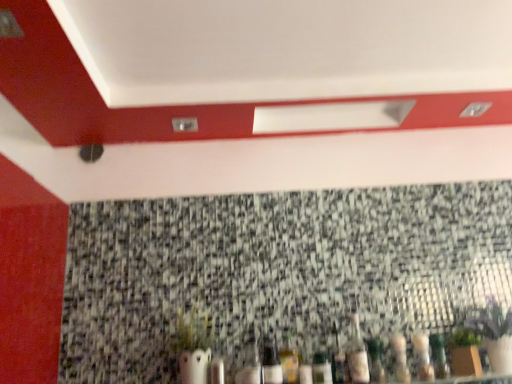
Question: Should I look upward or downward to see granite mosaic at center?

Choices:
 (A) down
 (B) up

Answer: (A)

Question: Is translucent glass bottle at lower right, marked as the first bottle in a right-to-left arrangement, at the right side of translucent glass bottle at center, which ranks as the 5th bottle in right-to-left order?

Choices:
 (A) no
 (B) yes

Answer: (B)

Question: Is translucent glass bottle at center, the 3th bottle from the left, at the back of translucent glass bottle at lower right, marked as the first bottle in a right-to-left arrangement?

Choices:
 (A) yes
 (B) no

Answer: (B)

Question: Is translucent glass bottle at lower right, marked as the first bottle in a right-to-left arrangement, far from translucent glass bottle at center, the 3th bottle from the left?

Choices:
 (A) no
 (B) yes

Answer: (A)

Question: Is translucent glass bottle at lower right, marked as the first bottle in a right-to-left arrangement, thinner than translucent glass bottle at center, which ranks as the 5th bottle in right-to-left order?

Choices:
 (A) no
 (B) yes

Answer: (A)

Question: Is translucent glass bottle at lower right, which is the 7th bottle in left-to-right order, to the left of translucent glass bottle at center, which ranks as the 5th bottle in right-to-left order, from the viewer's perspective?

Choices:
 (A) yes
 (B) no

Answer: (B)

Question: Considering the relative positions of translucent glass bottle at lower right, which is the 7th bottle in left-to-right order, and translucent glass bottle at center, which ranks as the 5th bottle in right-to-left order, in the image provided, is translucent glass bottle at lower right, which is the 7th bottle in left-to-right order, behind translucent glass bottle at center, which ranks as the 5th bottle in right-to-left order,?

Choices:
 (A) no
 (B) yes

Answer: (B)

Question: Is translucent glass bottle at lower center, arranged as the 6th bottle when viewed from the right, positioned before clear glass bottle at center, acting as the seventh bottle starting from the right?

Choices:
 (A) yes
 (B) no

Answer: (B)

Question: Is translucent glass bottle at lower center, the second bottle when ordered from left to right, aimed at clear glass bottle at center, acting as the seventh bottle starting from the right?

Choices:
 (A) yes
 (B) no

Answer: (B)

Question: Considering the relative sizes of translucent glass bottle at lower center, arranged as the 6th bottle when viewed from the right, and clear glass bottle at center, which appears as the 1th bottle when viewed from the left, in the image provided, is translucent glass bottle at lower center, arranged as the 6th bottle when viewed from the right, bigger than clear glass bottle at center, which appears as the 1th bottle when viewed from the left,?

Choices:
 (A) no
 (B) yes

Answer: (A)

Question: From the image's perspective, is translucent glass bottle at lower center, arranged as the 6th bottle when viewed from the right, located beneath clear glass bottle at center, acting as the seventh bottle starting from the right?

Choices:
 (A) yes
 (B) no

Answer: (B)

Question: Is translucent glass bottle at lower center, the second bottle when ordered from left to right, positioned behind clear glass bottle at center, acting as the seventh bottle starting from the right?

Choices:
 (A) yes
 (B) no

Answer: (A)

Question: Considering the relative sizes of translucent glass bottle at lower center, arranged as the 6th bottle when viewed from the right, and clear glass bottle at center, which appears as the 1th bottle when viewed from the left, in the image provided, is translucent glass bottle at lower center, arranged as the 6th bottle when viewed from the right, smaller than clear glass bottle at center, which appears as the 1th bottle when viewed from the left,?

Choices:
 (A) yes
 (B) no

Answer: (A)

Question: Considering the relative sizes of granite mosaic at center and clear glass bottle at center, acting as the seventh bottle starting from the right, in the image provided, is granite mosaic at center shorter than clear glass bottle at center, acting as the seventh bottle starting from the right,?

Choices:
 (A) no
 (B) yes

Answer: (A)